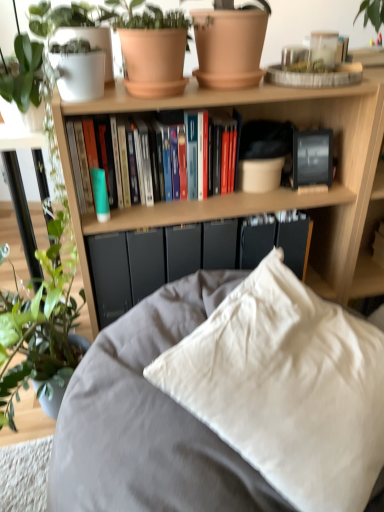
Question: Should I look upward or downward to see matte black paperback book at center, acting as the second paperback book starting from the left?

Choices:
 (A) up
 (B) down

Answer: (A)

Question: From a real-world perspective, is wooden bookcase at upper center under hardcover books at center?

Choices:
 (A) yes
 (B) no

Answer: (A)

Question: Can you confirm if wooden bookcase at upper center is taller than hardcover books at center?

Choices:
 (A) yes
 (B) no

Answer: (A)

Question: Does wooden bookcase at upper center have a larger size compared to hardcover books at center?

Choices:
 (A) no
 (B) yes

Answer: (B)

Question: Is wooden bookcase at upper center positioned beyond the bounds of hardcover books at center?

Choices:
 (A) yes
 (B) no

Answer: (A)

Question: Would you say wooden bookcase at upper center contains hardcover books at center?

Choices:
 (A) yes
 (B) no

Answer: (A)

Question: Does wooden bookcase at upper center come in front of hardcover books at center?

Choices:
 (A) no
 (B) yes

Answer: (B)

Question: Is matte black paperback book at center, acting as the second paperback book starting from the left, at the back of terracotta clay pot at upper center, the 2th flowerpot viewed from the right?

Choices:
 (A) yes
 (B) no

Answer: (B)

Question: Can you see terracotta clay pot at upper center, the 2th flowerpot viewed from the right, touching matte black paperback book at center, acting as the second paperback book starting from the left?

Choices:
 (A) yes
 (B) no

Answer: (B)

Question: Is terracotta clay pot at upper center, the 2th flowerpot viewed from the right, thinner than matte black paperback book at center, the 1th paperback book viewed from the right?

Choices:
 (A) no
 (B) yes

Answer: (A)

Question: Can matte black paperback book at center, the 1th paperback book viewed from the right, be found inside terracotta clay pot at upper center, the 2th flowerpot viewed from the right?

Choices:
 (A) no
 (B) yes

Answer: (A)

Question: Does terracotta clay pot at upper center, the 2th flowerpot viewed from the right, have a larger size compared to matte black paperback book at center, acting as the second paperback book starting from the left?

Choices:
 (A) yes
 (B) no

Answer: (A)

Question: From a real-world perspective, is terracotta clay pot at upper center, the 1th flowerpot positioned from the left, below matte black paperback book at center, the 1th paperback book viewed from the right?

Choices:
 (A) yes
 (B) no

Answer: (B)

Question: Does white cotton pillow at center have a lesser height compared to wooden bookcase at upper center?

Choices:
 (A) yes
 (B) no

Answer: (A)